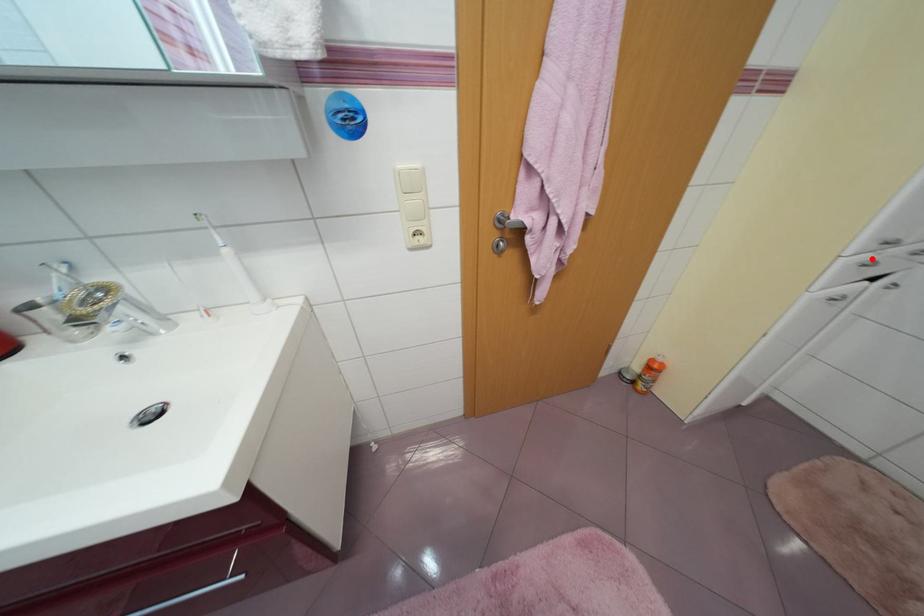
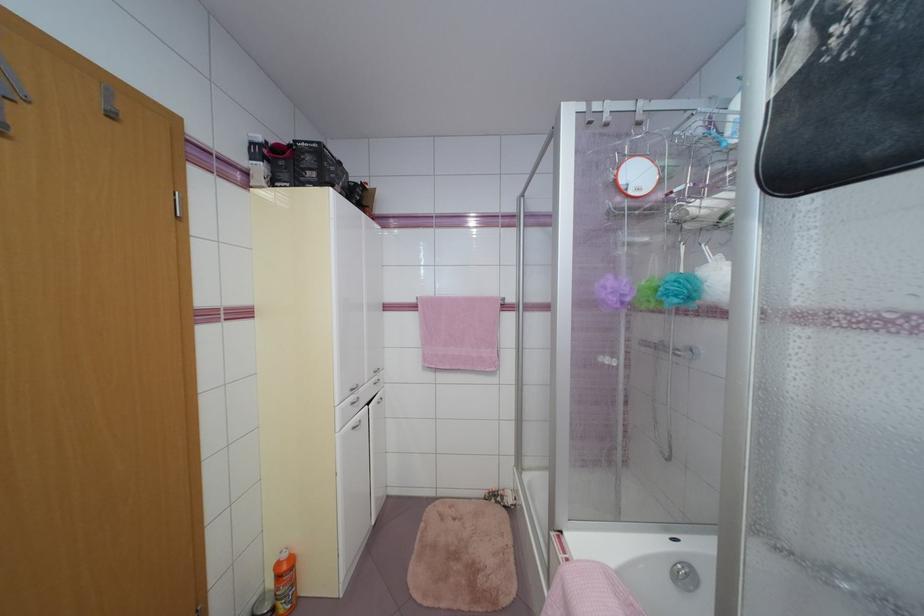
In the second image, find the point that corresponds to the highlighted location in the first image.

(357, 400)